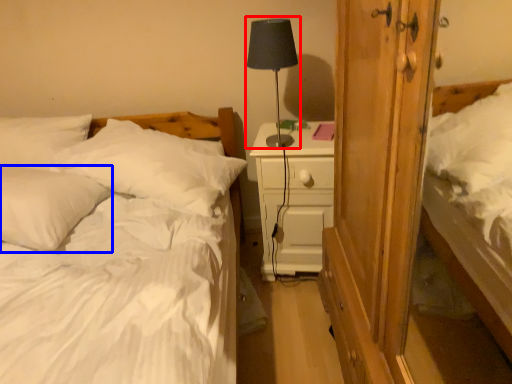
Question: Which of the following is the farthest to the observer, table lamp (highlighted by a red box) or pillow (highlighted by a blue box)?

Choices:
 (A) table lamp
 (B) pillow

Answer: (A)